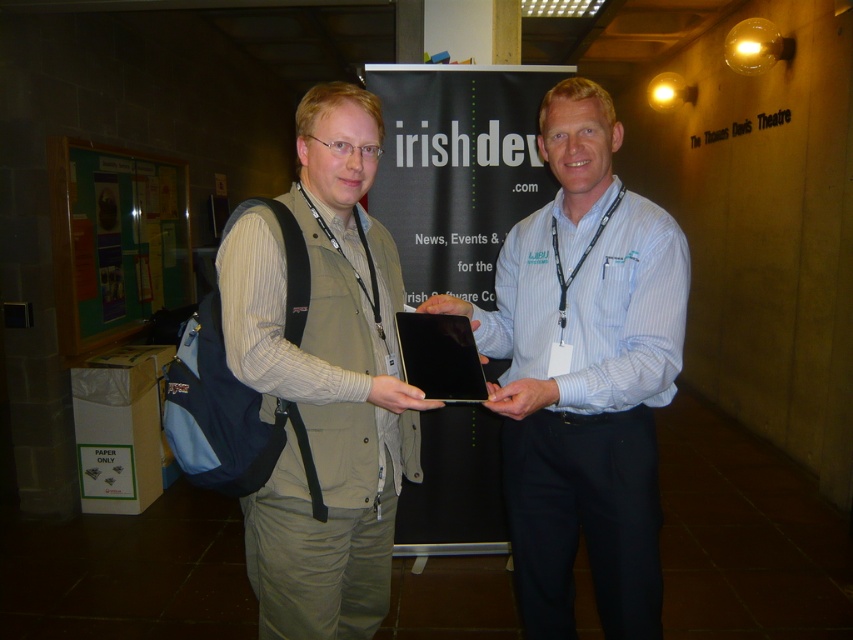
Can you confirm if light blue striped shirt at center is positioned to the right of matte khaki vest at center?

Yes, light blue striped shirt at center is to the right of matte khaki vest at center.

What do you see at coordinates (584, 374) in the screenshot? The width and height of the screenshot is (853, 640). I see `light blue striped shirt at center` at bounding box center [584, 374].

Where is `light blue striped shirt at center`? The height and width of the screenshot is (640, 853). light blue striped shirt at center is located at coordinates (584, 374).